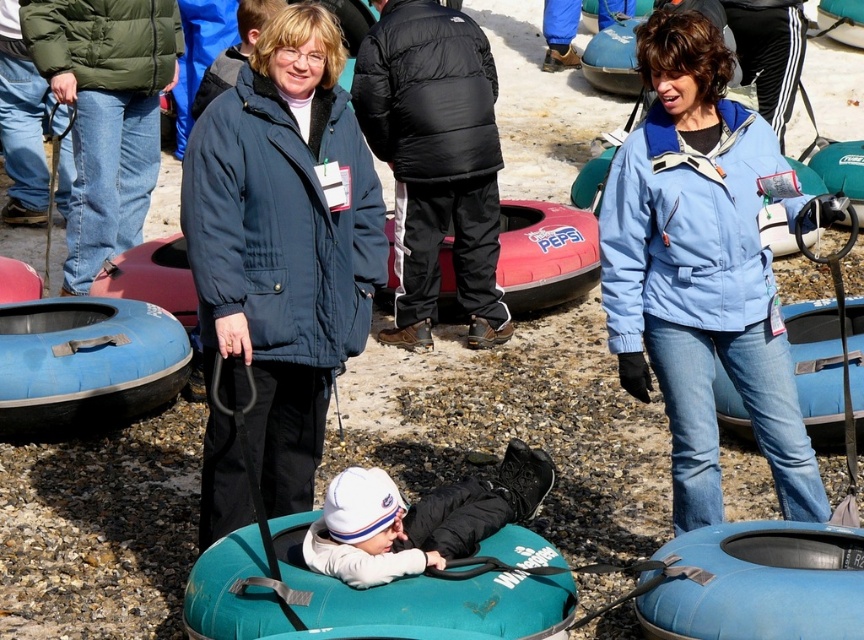
Is point (233, 545) farther from camera compared to point (820, 29)?

No, it is in front of (820, 29).

Is teal rubber tube at center thinner than blue rubber raft at center?

In fact, teal rubber tube at center might be wider than blue rubber raft at center.

Is point (564, 586) positioned after point (829, 28)?

No.

The width and height of the screenshot is (864, 640). I want to click on teal rubber tube at center, so click(360, 596).

Measure the distance between point [480,92] and camera.

Point [480,92] and camera are 11.09 meters apart.

Is point (448, 161) positioned after point (804, 380)?

Yes, it is behind point (804, 380).

Which is behind, point (448, 49) or point (824, 348)?

Point (448, 49)

Image resolution: width=864 pixels, height=640 pixels. I want to click on black puffy jacket at center, so click(435, 161).

Does white fleece jacket at center have a greater height compared to rubber boat at center?

In fact, white fleece jacket at center may be shorter than rubber boat at center.

Which is more to the right, white fleece jacket at center or rubber boat at center?

From the viewer's perspective, rubber boat at center appears more on the right side.

Does point (403, 573) lie behind point (556, 240)?

No, (403, 573) is in front of (556, 240).

The width and height of the screenshot is (864, 640). I want to click on white fleece jacket at center, so click(424, 518).